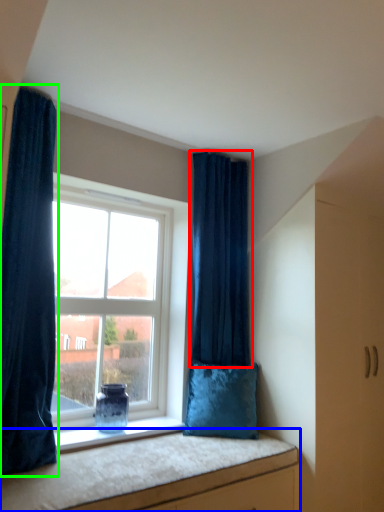
Question: Considering the real-world distances, which object is farthest from curtain (highlighted by a red box)? vanity (highlighted by a blue box) or curtain (highlighted by a green box)?

Choices:
 (A) vanity
 (B) curtain

Answer: (B)